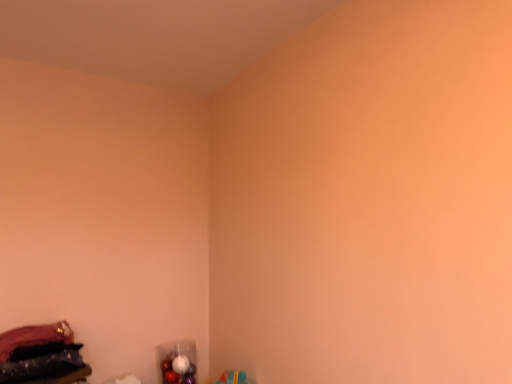
Question: Should I look upward or downward to see velvet purple fabric at lower left?

Choices:
 (A) down
 (B) up

Answer: (A)